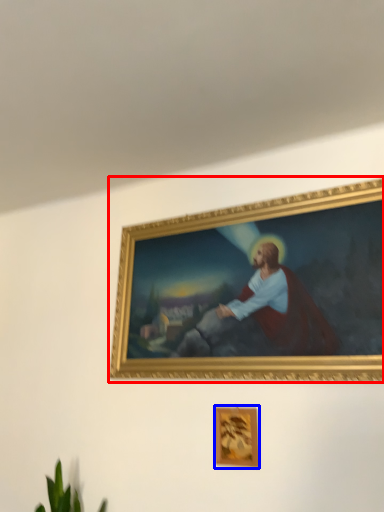
Question: Which of the following is the closest to the observer, picture frame (highlighted by a red box) or picture frame (highlighted by a blue box)?

Choices:
 (A) picture frame
 (B) picture frame

Answer: (A)